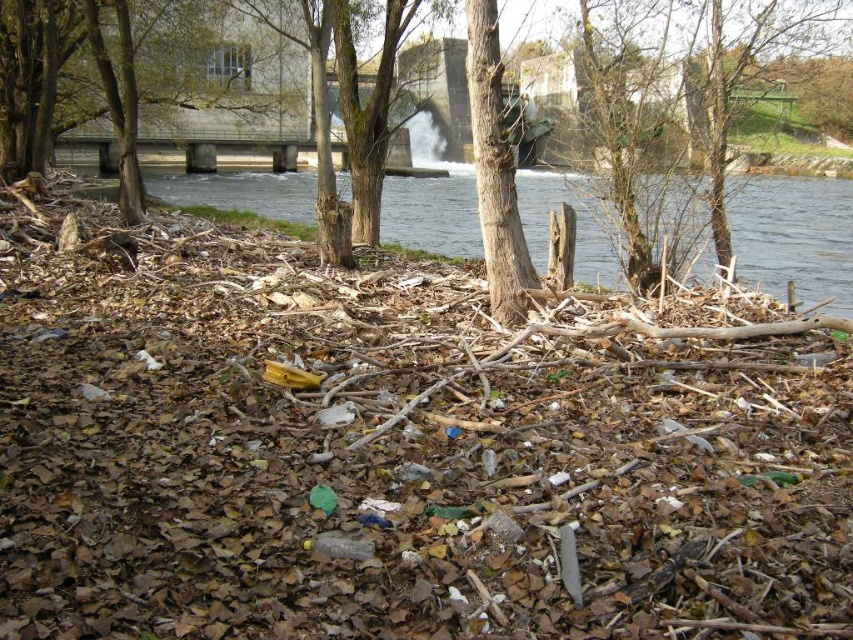
Question: Is clear water at center to the left of brown rough bark tree at center from the viewer's perspective?

Choices:
 (A) yes
 (B) no

Answer: (A)

Question: Which point is farther to the camera?

Choices:
 (A) brown wood tree at center
 (B) brown rough bark tree at center
 (C) clear water at center

Answer: (A)

Question: Is clear water at center below brown rough bark tree at center?

Choices:
 (A) no
 (B) yes

Answer: (A)

Question: Which point is closer to the camera?

Choices:
 (A) clear water at center
 (B) brown wood tree at center
 (C) brown rough bark tree at center

Answer: (C)

Question: Which object appears closest to the camera in this image?

Choices:
 (A) brown rough bark tree at center
 (B) brown wood tree at center
 (C) clear water at center

Answer: (A)

Question: Where is clear water at center located in relation to brown rough bark tree at center in the image?

Choices:
 (A) left
 (B) right

Answer: (A)